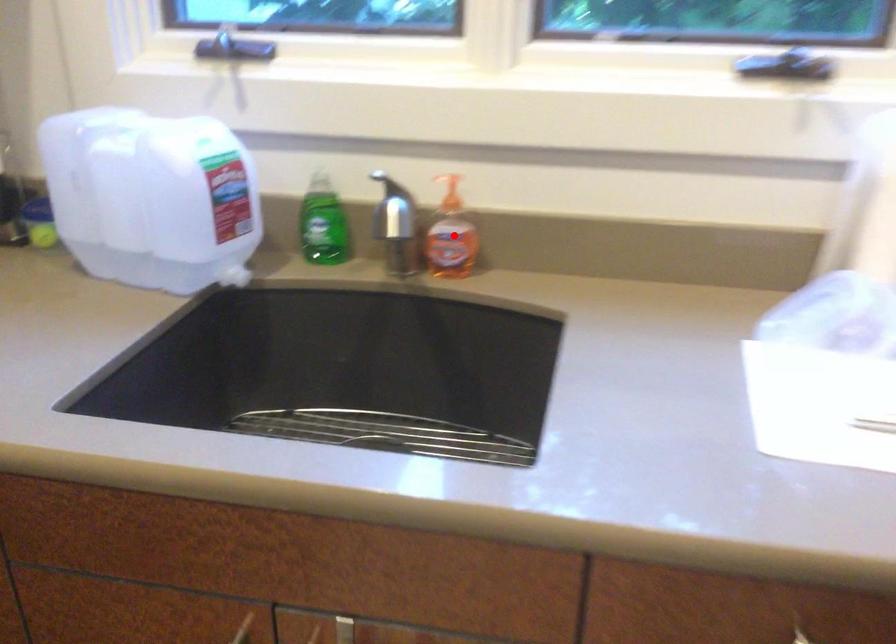
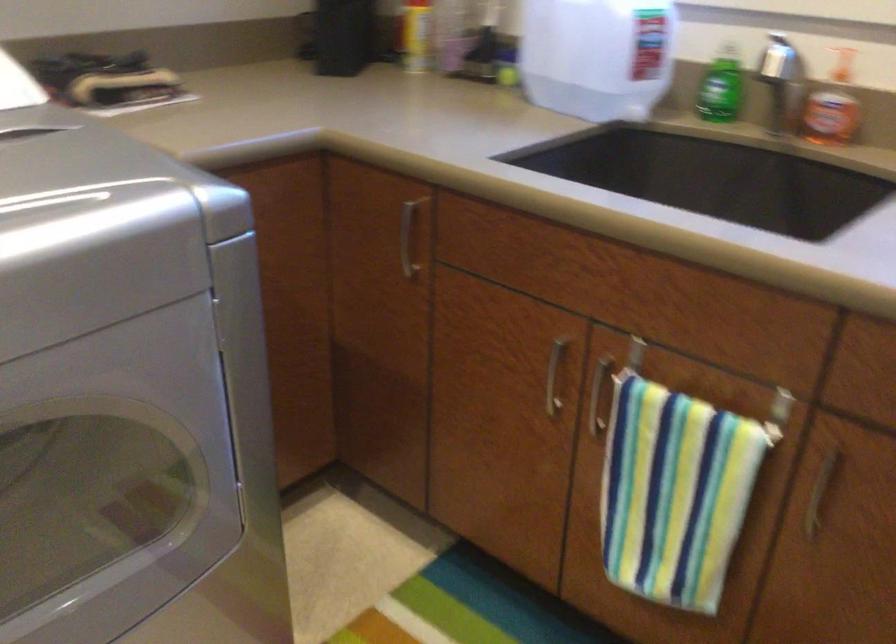
Question: I am providing you with two images of the same scene from different viewpoints. A red point is marked on the first image. Is the red point's position out of view in image 2?

Choices:
 (A) Yes
 (B) No

Answer: (B)